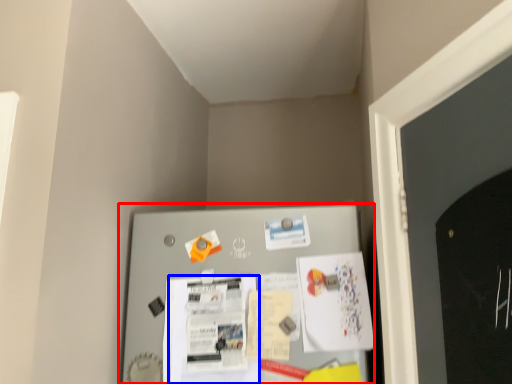
Question: Which object appears farthest to the camera in this image, bulletin board (highlighted by a red box) or poster (highlighted by a blue box)?

Choices:
 (A) bulletin board
 (B) poster

Answer: (B)